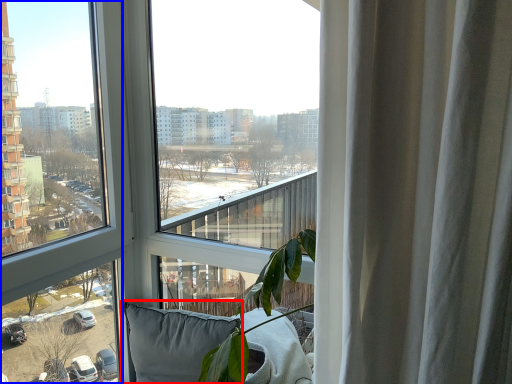
Question: Among these objects, which one is farthest to the camera, pillow (highlighted by a red box) or window (highlighted by a blue box)?

Choices:
 (A) pillow
 (B) window

Answer: (A)